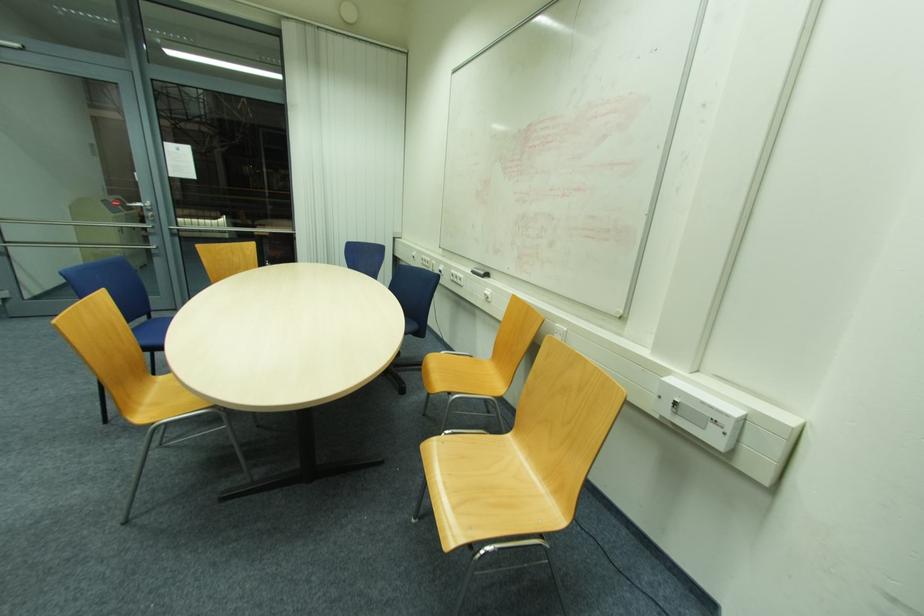
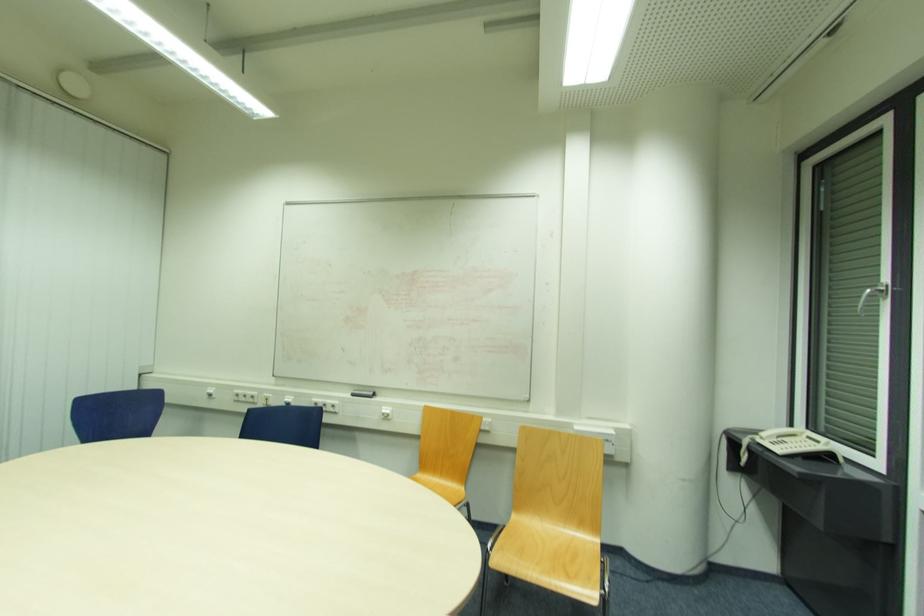
Find the pixel in the second image that matches [475,273] in the first image.

(355, 395)